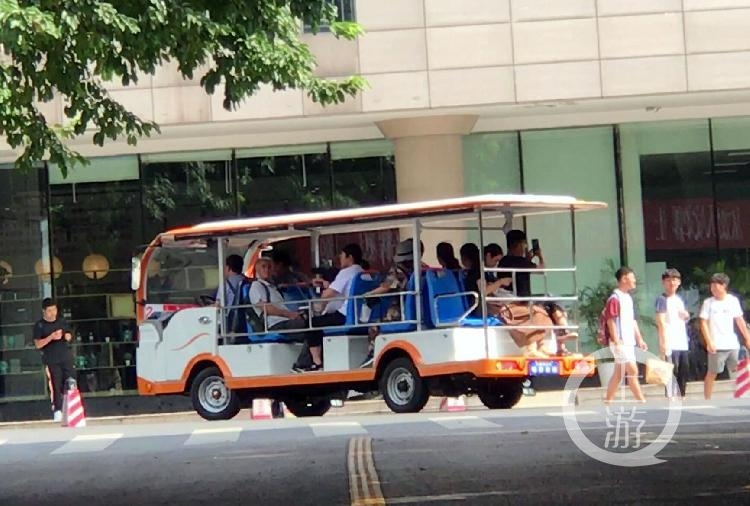
Locate an element on the screen. This screenshot has width=750, height=506. light fixtures is located at coordinates (100, 270), (43, 274).